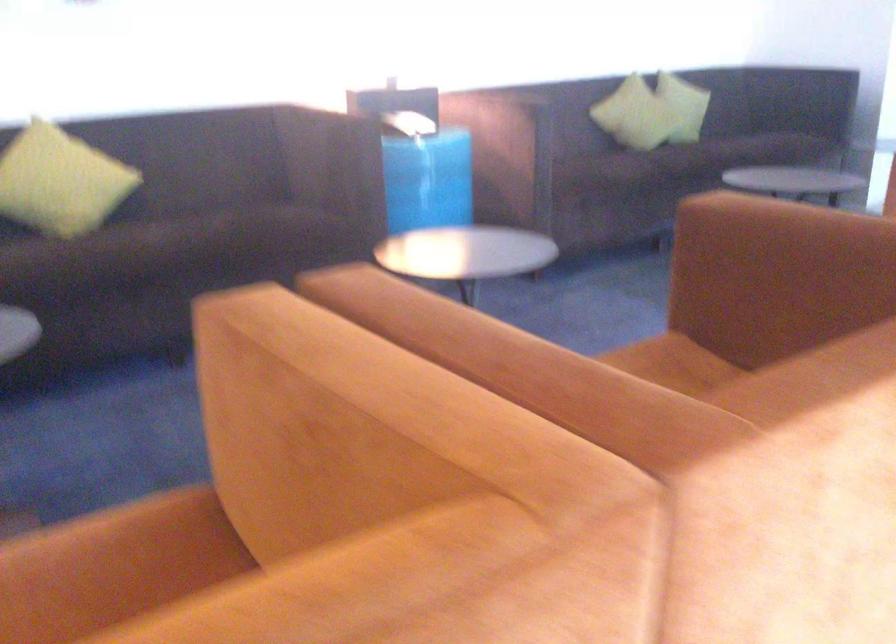
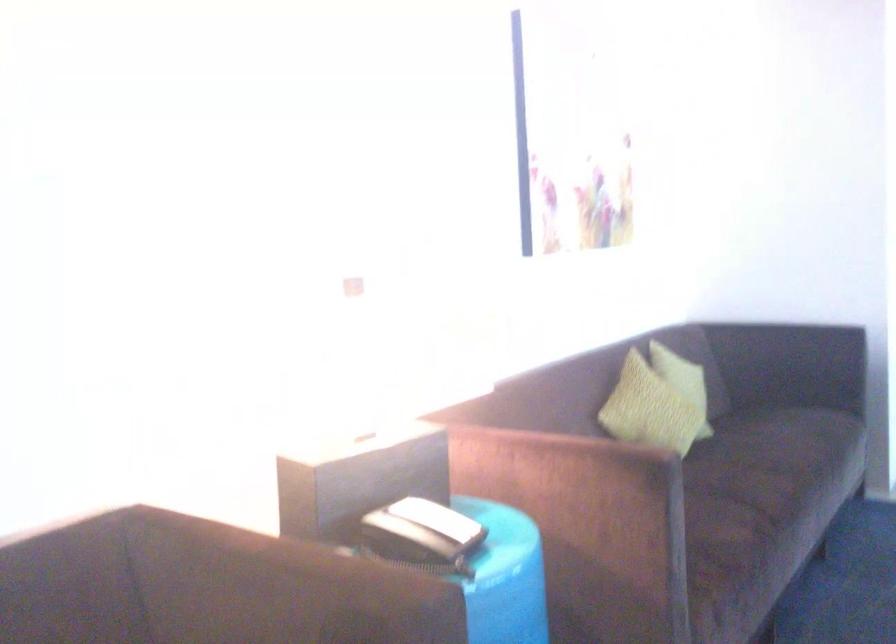
Which direction would the cameraman need to move to produce the second image?

The cameraman moved toward left, forward.